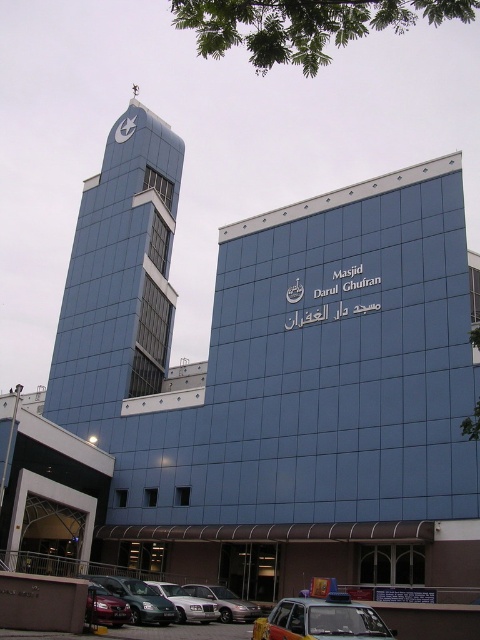
You are a visitor approaching the Masjid Darul Ghufran and notice a metallic taxi cab at lower center and a metallic clock at upper center. Which object appears bigger in the image?

The metallic taxi cab at lower center appears bigger than the metallic clock at upper center in the image.

You are a visitor approaching the Masjid Darul Ghufran and see the metallic taxi cab at lower center and the metallic clock at upper center. Which object is closer to you as you approach the building?

The metallic taxi cab at lower center is closer to you because it is in front of the metallic clock at upper center.

You are standing at the entrance of Masjid Darul Ghufran and want to hail a ride. Is the metallic taxi cab at lower center positioned near the entrance area?

The metallic taxi cab at lower center is located at point (321, 620), which is near the entrance area marked by the covered walkway supported by dark brown beams. Therefore, the taxi is positioned near the entrance area.